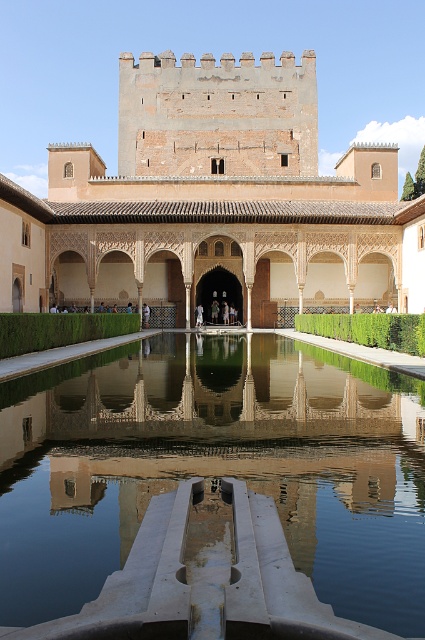
You are an architect visiting the courtyard and want to take a photo of the clear glass water at center and the brown stone palace at center. Which object should you focus on first if you want to capture both in a single frame without moving the camera?

The clear glass water at center is smaller than the brown stone palace at center, so you should focus on the brown stone palace at center first to ensure it fits properly in the frame.

You are a visitor standing in the courtyard and want to take a photo of the brown stone palace at center without the clear glass water at center blocking the view. Is it possible to do so by moving to a different position?

The clear glass water at center is in front of the brown stone palace at center, so you can move behind the clear glass water at center to take a photo of the brown stone palace at center without obstruction.

You are an architect visiting the courtyard and need to determine the relative thickness of two central elements. Which is thicker between the clear glass water at center and the brown stone palace at center?

The brown stone palace at center is thicker than the clear glass water at center because the clear glass water at center is thinner than brown stone palace at center.